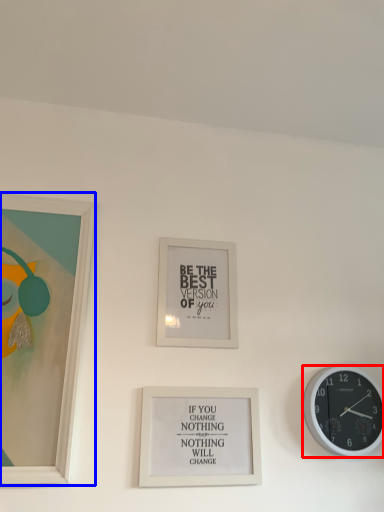
Question: Which point is further to the camera, wall clock (highlighted by a red box) or picture frame (highlighted by a blue box)?

Choices:
 (A) wall clock
 (B) picture frame

Answer: (A)